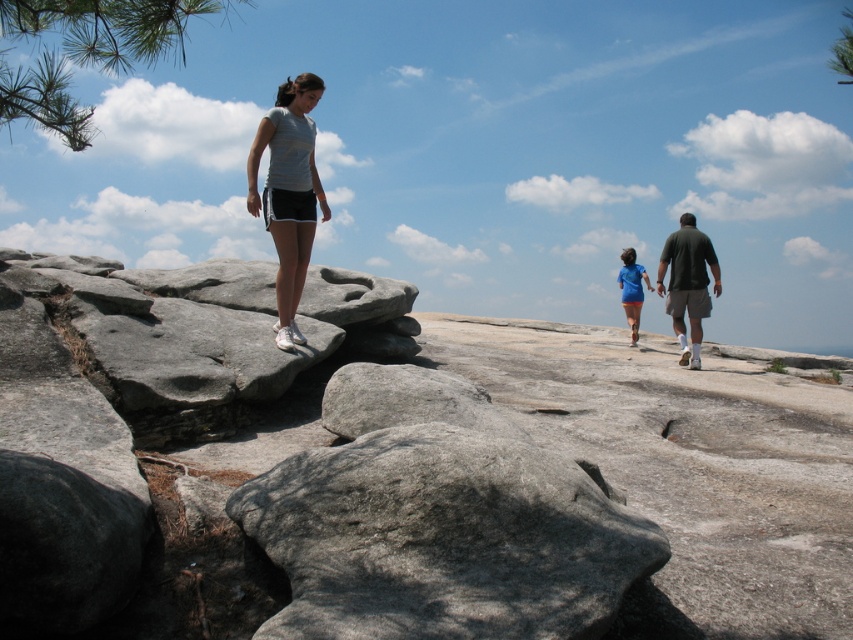
You are standing at the point with coordinates point (288, 193) in the image. What object is located exactly at this point?

The point (288, 193) corresponds to the light gray t shirt at center.

You are navigating a rocky path and see two points marked on your map. The first point is at coordinates point (483, 605) and the second is at point (651, 285). According to the scene, which point is closer to your current position if you are facing the direction of travel?

Point (483, 605) is in front of point (651, 285), so the first point is closer to your current position when facing the direction of travel.

What object does the point at coordinates (444, 538) correspond to in the scene?

The point at coordinates (444, 538) corresponds to the gray rough rock at center.